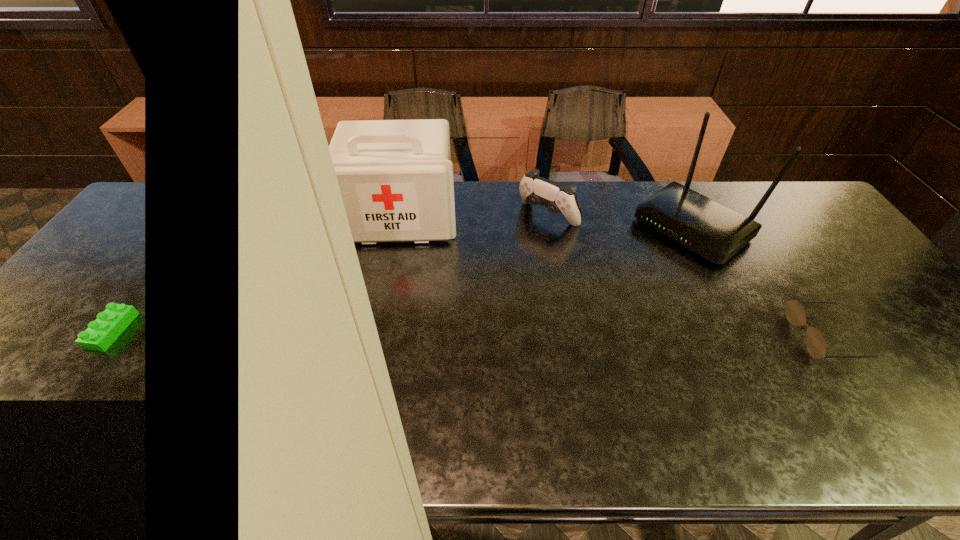
Locate an element on the screen. Image resolution: width=960 pixels, height=540 pixels. free space that is in between the router and the first-aid kit is located at coordinates (547, 222).

Choose which object is the nearest neighbor to the control. Please provide its 2D coordinates. Your answer should be formatted as a tuple, i.e. [(x, y)], where the tuple contains the x and y coordinates of a point satisfying the conditions above.

[(715, 232)]

Identify which object is the closest to the first-aid kit. Please provide its 2D coordinates. Your answer should be formatted as a tuple, i.e. [(x, y)], where the tuple contains the x and y coordinates of a point satisfying the conditions above.

[(535, 190)]

Find the location of a particular element. Image resolution: width=960 pixels, height=540 pixels. vacant space that satisfies the following two spatial constraints: 1. on the front side of the sunglasses; 2. on the front-facing side of the control is located at coordinates (569, 336).

Identify the location of free location that satisfies the following two spatial constraints: 1. on the back side of the leftmost object; 2. on the left side of the third tallest object. Image resolution: width=960 pixels, height=540 pixels. (401, 215).

Image resolution: width=960 pixels, height=540 pixels. I want to click on free space that satisfies the following two spatial constraints: 1. on the front side of the nearest object; 2. on the front-facing side of the leftmost object, so click(377, 336).